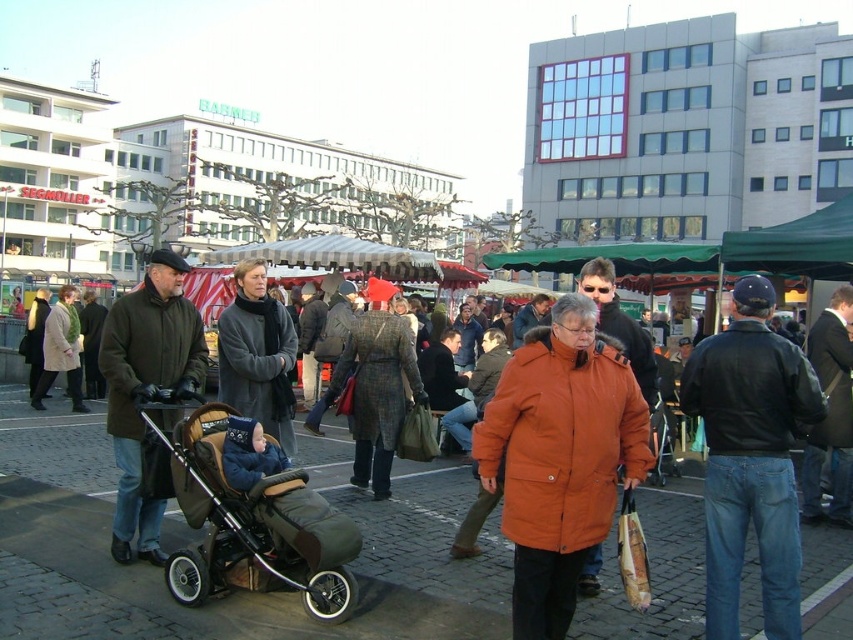
Question: Considering the relative positions of brown leather baby carriage at center-left and dark gray wool coat at center in the image provided, where is brown leather baby carriage at center-left located with respect to dark gray wool coat at center?

Choices:
 (A) left
 (B) right

Answer: (B)

Question: Does dark brown leather coat at left appear on the right side of light beige wool coat at center?

Choices:
 (A) yes
 (B) no

Answer: (A)

Question: Which object is farther from the camera taking this photo?

Choices:
 (A) orange matte coat at center
 (B) brown leather baby carriage at center-left

Answer: (B)

Question: Which point is closer to the camera taking this photo?

Choices:
 (A) (537, 428)
 (B) (154, 532)

Answer: (A)

Question: Which object is the farthest from the light beige wool coat at center?

Choices:
 (A) dark brown leather coat at left
 (B) black leather jacket at right
 (C) dark gray wool coat at center
 (D) brown leather baby carriage at center-left

Answer: (B)

Question: In this image, where is black leather jacket at right located relative to light beige wool coat at center?

Choices:
 (A) above
 (B) below

Answer: (B)